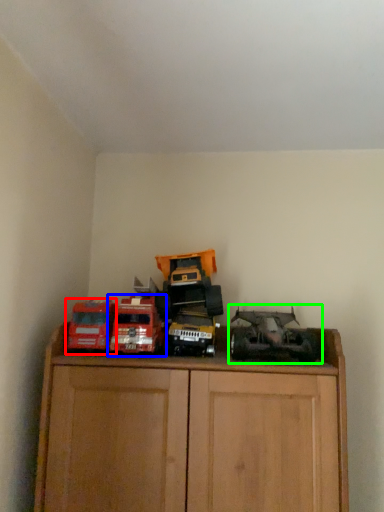
Question: Which object is the closest to the toy (highlighted by a red box)? Choose among these: toy (highlighted by a blue box) or toy (highlighted by a green box).

Choices:
 (A) toy
 (B) toy

Answer: (A)